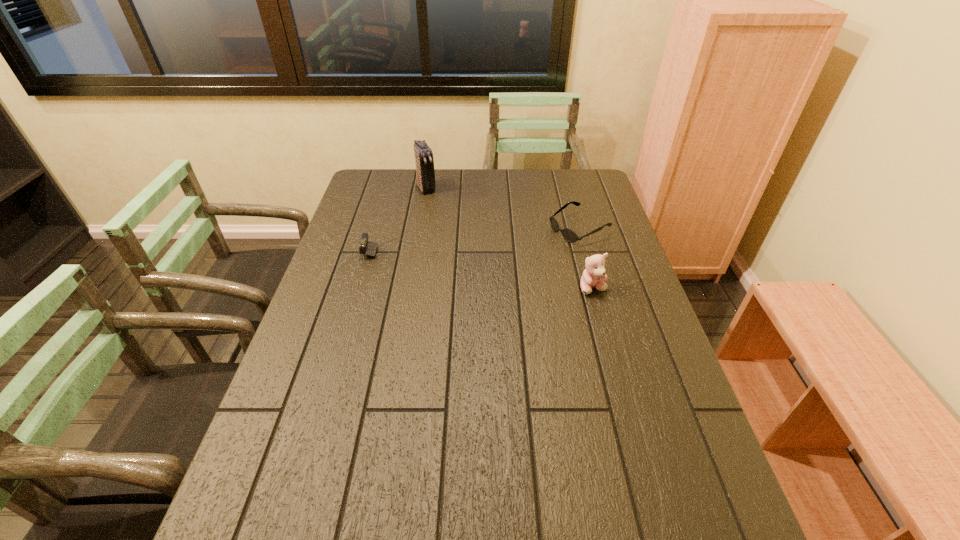
You are a GUI agent. You are given a task and a screenshot of the screen. Output one action in this format:
    pyautogui.click(x=<x>, y=<y>)
    Task: Click on the vacant space located on the lenses of the sunglasses
    
    Given the screenshot: What is the action you would take?
    pyautogui.click(x=538, y=247)

The height and width of the screenshot is (540, 960). What are the coordinates of `vacant space located 0.270m on the lenses of the sunglasses` in the screenshot? It's located at (490, 269).

Identify the location of free spot located 0.120m on the lenses of the sunglasses. (528, 252).

In order to click on object present at the far edge in this screenshot , I will do `click(425, 172)`.

The width and height of the screenshot is (960, 540). I want to click on object located in the left edge section of the desktop, so click(369, 248).

Image resolution: width=960 pixels, height=540 pixels. What are the coordinates of `teddy bear present at the right edge` in the screenshot? It's located at (594, 275).

Locate an element on the screen. This screenshot has height=540, width=960. sunglasses present at the right edge is located at coordinates (569, 235).

You are a GUI agent. You are given a task and a screenshot of the screen. Output one action in this format:
    pyautogui.click(x=<x>, y=<y>)
    Task: Click on the vacant space at the far edge of the desktop
    The image size is (960, 540).
    Given the screenshot: What is the action you would take?
    pos(550,189)

Identify the location of vacant space at the left edge. (379, 218).

Locate an element on the screen. The width and height of the screenshot is (960, 540). vacant space at the right edge of the desktop is located at coordinates (580, 247).